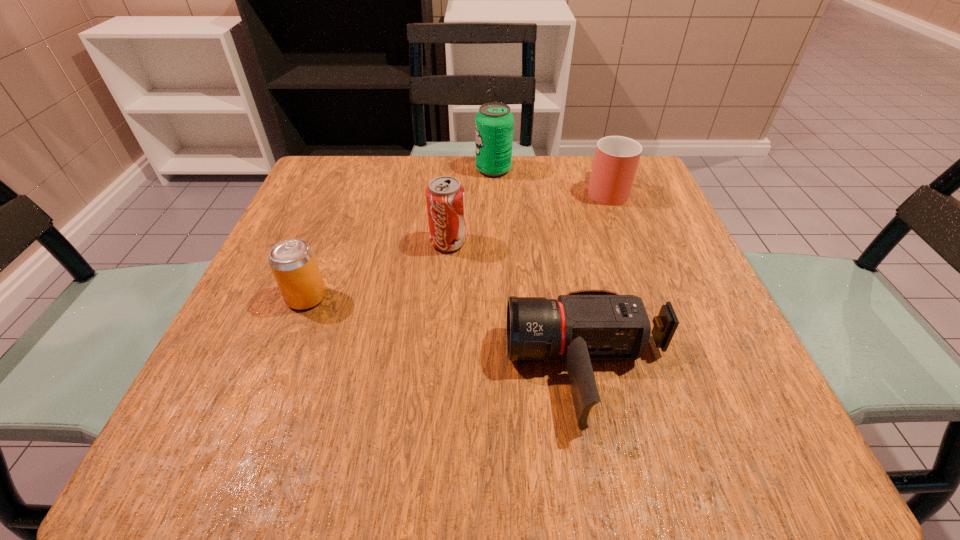
At what (x,y) coordinates should I click in order to perform the action: click on the farthest pop (soda). Please return your answer as a coordinate pair (x, y). Looking at the image, I should click on (494, 122).

The width and height of the screenshot is (960, 540). What are the coordinates of `the second pop (soda) from right to left` in the screenshot? It's located at (x=445, y=196).

What are the coordinates of `the fourth object from right to left` in the screenshot? It's located at (445, 196).

Identify the location of cup. The width and height of the screenshot is (960, 540). (616, 160).

You are a GUI agent. You are given a task and a screenshot of the screen. Output one action in this format:
    pyautogui.click(x=<x>, y=<y>)
    Task: Click on the leftmost pop (soda)
    The width and height of the screenshot is (960, 540).
    Given the screenshot: What is the action you would take?
    point(293,263)

Find the location of a particular element. the shortest pop (soda) is located at coordinates (293, 263).

Find the location of a particular element. Image resolution: width=960 pixels, height=540 pixels. the nearest object is located at coordinates (584, 325).

Locate an element on the screen. Image resolution: width=960 pixels, height=540 pixels. vacant area located 0.350m on the front-facing side of the farthest pop (soda) is located at coordinates (333, 169).

Image resolution: width=960 pixels, height=540 pixels. I want to click on free space located 0.280m on the front-facing side of the farthest pop (soda), so click(362, 169).

The width and height of the screenshot is (960, 540). Identify the location of vacant region located on the front-facing side of the farthest pop (soda). (317, 169).